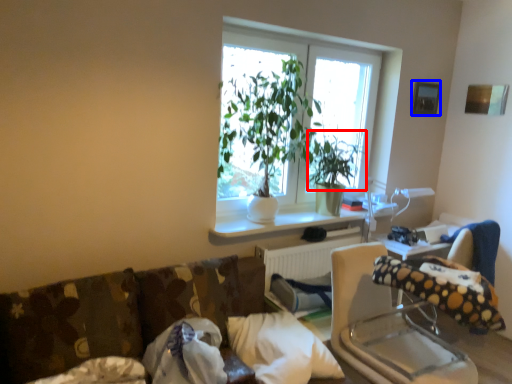
Question: Which object is closer to the camera taking this photo, plant (highlighted by a red box) or picture frame (highlighted by a blue box)?

Choices:
 (A) plant
 (B) picture frame

Answer: (A)